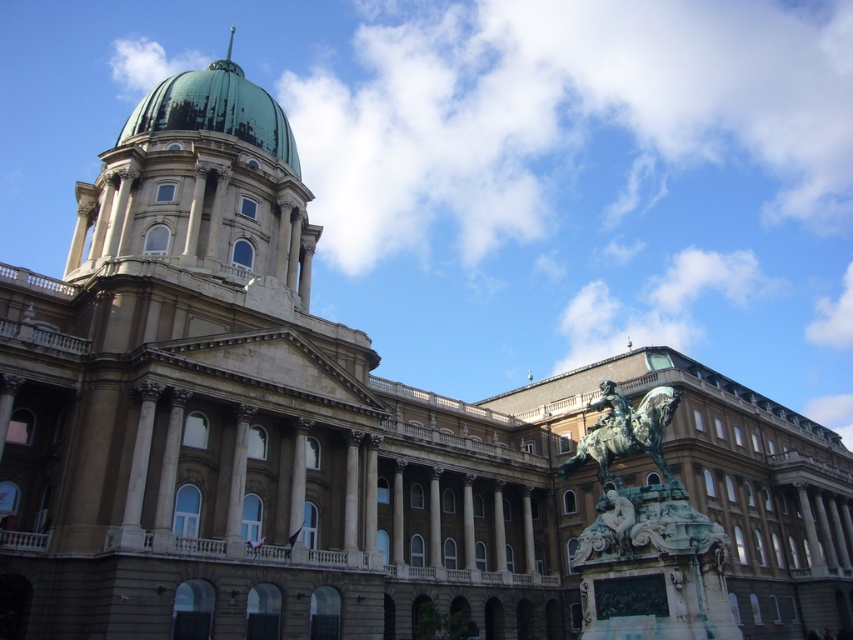
Does green polished dome at upper center appear under green patina statue at center-right?

Actually, green polished dome at upper center is above green patina statue at center-right.

Does green polished dome at upper center lie in front of green patina statue at center-right?

No.

Locate an element on the screen. green polished dome at upper center is located at coordinates pos(215,109).

Is the position of green polished dome at upper center more distant than that of green patina spire at top?

No, green polished dome at upper center is closer to the viewer.

Who is shorter, green polished dome at upper center or green patina spire at top?

Standing shorter between the two is green polished dome at upper center.

What do you see at coordinates (215, 109) in the screenshot?
I see `green polished dome at upper center` at bounding box center [215, 109].

The width and height of the screenshot is (853, 640). What are the coordinates of `green polished dome at upper center` in the screenshot? It's located at (215, 109).

Can you confirm if green patina statue at center-right is positioned to the left of green patina spire at top?

No, green patina statue at center-right is not to the left of green patina spire at top.

Is green patina statue at center-right wider than green patina spire at top?

→ Indeed, green patina statue at center-right has a greater width compared to green patina spire at top.

Does point (645, 413) lie behind point (229, 28)?

No, it is in front of (229, 28).

Find the location of a particular element. green patina statue at center-right is located at coordinates (624, 429).